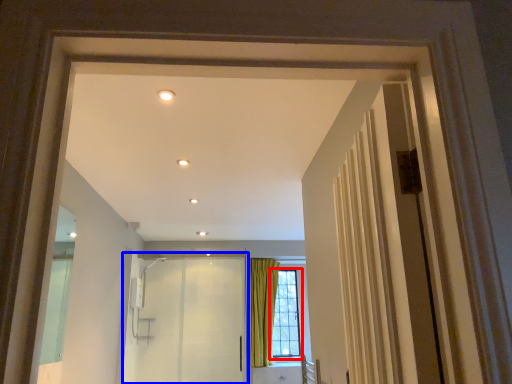
Question: Which object is closer to the camera taking this photo, window (highlighted by a red box) or elevator (highlighted by a blue box)?

Choices:
 (A) window
 (B) elevator

Answer: (B)